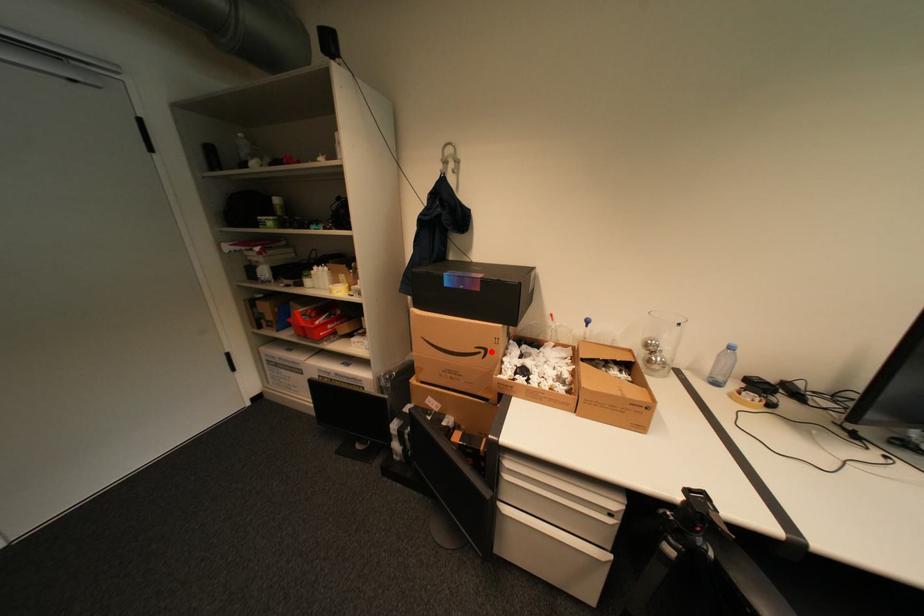
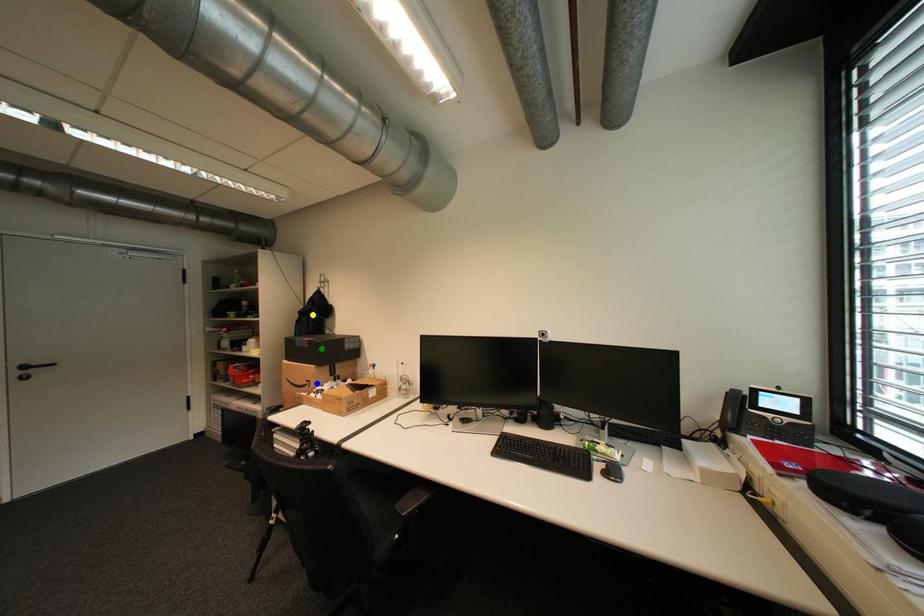
Question: I am providing you with two images of the same scene from different viewpoints. A red point is marked on the first image. You are given multiple points on the second image. Which mark in image 2 goes with the point in image 1?

Choices:
 (A) blue point
 (B) yellow point
 (C) green point

Answer: (A)